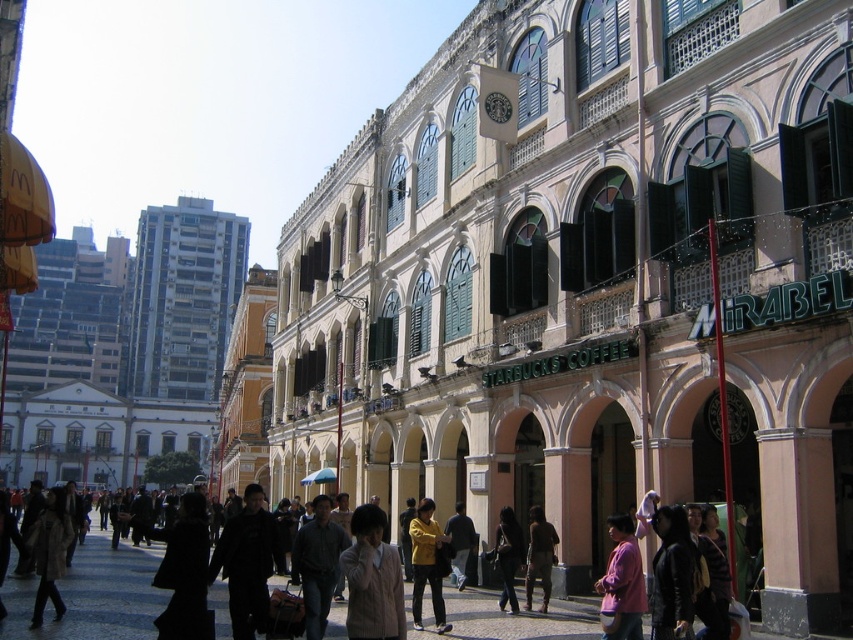
Question: Which point is farther from the camera taking this photo?

Choices:
 (A) (508, 602)
 (B) (619, 572)

Answer: (A)

Question: Which is nearer to the light brown coat at center?

Choices:
 (A) pink matte shirt at lower right
 (B) brown leather pants at center

Answer: (B)

Question: Can you confirm if brown leather pants at center is positioned above dark blue jeans at center?

Choices:
 (A) yes
 (B) no

Answer: (A)

Question: Estimate the real-world distances between objects in this image. Which object is farther from the yellow matte jacket at center?

Choices:
 (A) dark blue jeans at center
 (B) brown leather pants at center

Answer: (B)

Question: From the image, what is the correct spatial relationship of light beige sweater at center in relation to yellow matte jacket at center?

Choices:
 (A) below
 (B) above

Answer: (B)

Question: Does pink matte shirt at lower right appear on the left side of dark blue jeans at center?

Choices:
 (A) yes
 (B) no

Answer: (B)